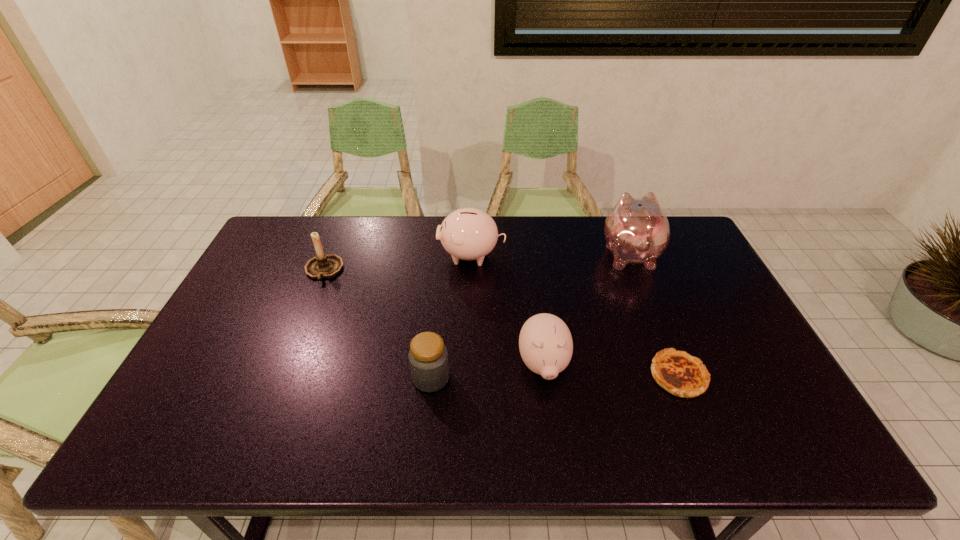
At what (x,y) coordinates should I click in order to perform the action: click on free space located on the front facing side of the tallest piggy bank. Please return your answer as a coordinate pair (x, y). This screenshot has height=540, width=960. Looking at the image, I should click on (614, 218).

At what (x,y) coordinates should I click in order to perform the action: click on vacant space located on the right of the second shortest piggy bank. Please return your answer as a coordinate pair (x, y). Looking at the image, I should click on (598, 255).

The width and height of the screenshot is (960, 540). Find the location of `vacant space situated on the left of the leftmost object`. vacant space situated on the left of the leftmost object is located at coordinates (289, 270).

At what (x,y) coordinates should I click in order to perform the action: click on vacant space positioned 0.090m at the snout of the second piggy bank from right to left. Please return your answer as a coordinate pair (x, y). This screenshot has height=540, width=960. Looking at the image, I should click on (551, 428).

In order to click on vacant space located 0.090m on the surface of the jar near the warning symbol in this screenshot , I will do [486, 377].

In order to click on free location located 0.380m on the back of the shortest object in this screenshot , I will do click(x=633, y=261).

Where is `candle holder that is positioned at the far edge`? candle holder that is positioned at the far edge is located at coordinates (322, 265).

Find the location of a particular element. The width and height of the screenshot is (960, 540). object that is positioned at the right edge is located at coordinates (636, 230).

Where is `object located in the far right corner section of the desktop`? This screenshot has height=540, width=960. object located in the far right corner section of the desktop is located at coordinates (636, 230).

Where is `vacant space at the far edge`? vacant space at the far edge is located at coordinates (599, 237).